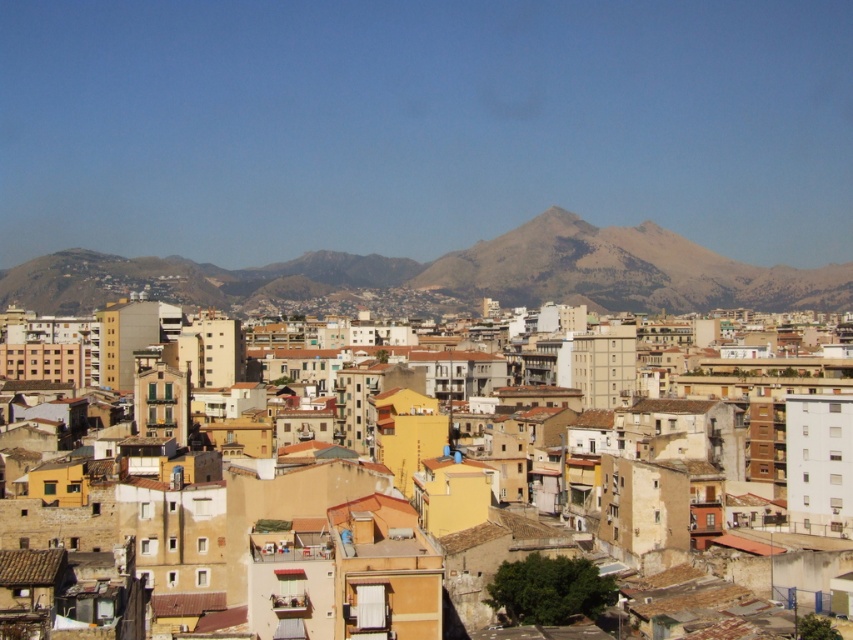
Question: Does gray rocky mountain at center appear on the left side of matte yellow building at center?

Choices:
 (A) yes
 (B) no

Answer: (B)

Question: Which point is closer to the camera?

Choices:
 (A) (653, 296)
 (B) (260, 502)

Answer: (B)

Question: Is gray rocky mountain at center bigger than matte yellow building at center?

Choices:
 (A) yes
 (B) no

Answer: (A)

Question: Which point is closer to the camera?

Choices:
 (A) matte yellow building at center
 (B) gray rocky mountain at center

Answer: (A)

Question: Can you confirm if gray rocky mountain at center is positioned to the left of matte yellow building at center?

Choices:
 (A) yes
 (B) no

Answer: (B)